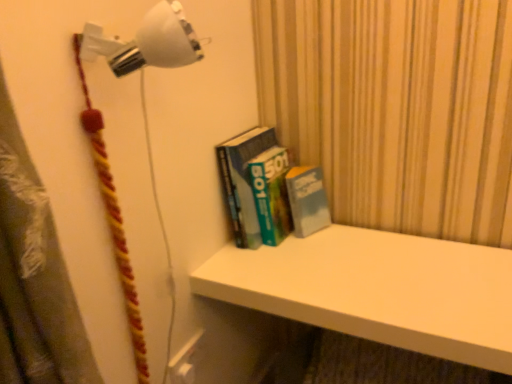
Where is `white plastic lamp at upper left, which is counted as the first lamp, starting from the bottom`? The height and width of the screenshot is (384, 512). white plastic lamp at upper left, which is counted as the first lamp, starting from the bottom is located at coordinates (103, 125).

Which is further, [88,94] or [323,187]?

The point [323,187] is farther from the camera.

From a real-world perspective, relative to hardcover books at center, is white plastic lamp at upper left, which ranks as the 2th lamp in top-to-bottom order, vertically above or below?

In terms of real-world spatial position, white plastic lamp at upper left, which ranks as the 2th lamp in top-to-bottom order, is above hardcover books at center.

From the image's perspective, relative to hardcover books at center, is white plastic lamp at upper left, which is counted as the first lamp, starting from the bottom, above or below?

white plastic lamp at upper left, which is counted as the first lamp, starting from the bottom, is below hardcover books at center.

Is white plastic lamp at upper left, which ranks as the 2th lamp in top-to-bottom order, wider than hardcover books at center?

No.

Is white plastic lamp at upper left, which is counted as the first lamp, starting from the bottom, to the left or to the right of white plastic wall lamp at upper left, the 2th lamp in the bottom-to-top sequence, in the image?

Based on their positions, white plastic lamp at upper left, which is counted as the first lamp, starting from the bottom, is located to the left of white plastic wall lamp at upper left, the 2th lamp in the bottom-to-top sequence.

Is point (106, 61) more distant than point (131, 66)?

That is True.

How many degrees apart are the facing directions of white plastic lamp at upper left, which ranks as the 2th lamp in top-to-bottom order, and white plastic wall lamp at upper left, which is counted as the first lamp, starting from the top?

There is a 0.00514-degree angle between the facing directions of white plastic lamp at upper left, which ranks as the 2th lamp in top-to-bottom order, and white plastic wall lamp at upper left, which is counted as the first lamp, starting from the top.

Which object is closer to the camera taking this photo, white plastic lamp at upper left, which ranks as the 2th lamp in top-to-bottom order, or white plastic wall lamp at upper left, the 2th lamp in the bottom-to-top sequence?

white plastic wall lamp at upper left, the 2th lamp in the bottom-to-top sequence, is in front.

How many degrees apart are the facing directions of white plastic wall lamp at upper left, which is counted as the first lamp, starting from the top, and white matte shelf at upper center?

They differ by 90 degrees in their facing directions.

From the image's perspective, is white plastic wall lamp at upper left, which is counted as the first lamp, starting from the top, located beneath white matte shelf at upper center?

Actually, white plastic wall lamp at upper left, which is counted as the first lamp, starting from the top, appears above white matte shelf at upper center in the image.

Is white plastic wall lamp at upper left, the 2th lamp in the bottom-to-top sequence, shorter than white matte shelf at upper center?

Correct, white plastic wall lamp at upper left, the 2th lamp in the bottom-to-top sequence, is not as tall as white matte shelf at upper center.

Is white matte shelf at upper center positioned before white plastic wall lamp at upper left, which is counted as the first lamp, starting from the top?

No, white matte shelf at upper center is behind white plastic wall lamp at upper left, which is counted as the first lamp, starting from the top.

Looking at this image, from a real-world perspective, is white matte shelf at upper center positioned above or below white plastic wall lamp at upper left, which is counted as the first lamp, starting from the top?

white matte shelf at upper center is below white plastic wall lamp at upper left, which is counted as the first lamp, starting from the top.

Who is taller, white matte shelf at upper center or white plastic wall lamp at upper left, the 2th lamp in the bottom-to-top sequence?

white matte shelf at upper center.

Is point (179, 5) positioned behind point (123, 247)?

Yes, it is.

Based on the photo, from a real-world perspective, is white plastic wall lamp at upper left, the 2th lamp in the bottom-to-top sequence, positioned over white plastic lamp at upper left, which ranks as the 2th lamp in top-to-bottom order, based on gravity?

Correct, in the physical world, white plastic wall lamp at upper left, the 2th lamp in the bottom-to-top sequence, is higher than white plastic lamp at upper left, which ranks as the 2th lamp in top-to-bottom order.

Is white plastic wall lamp at upper left, which is counted as the first lamp, starting from the top, smaller than white plastic lamp at upper left, which ranks as the 2th lamp in top-to-bottom order?

Incorrect, white plastic wall lamp at upper left, which is counted as the first lamp, starting from the top, is not smaller in size than white plastic lamp at upper left, which ranks as the 2th lamp in top-to-bottom order.

Which of these two, white plastic wall lamp at upper left, the 2th lamp in the bottom-to-top sequence, or white plastic lamp at upper left, which is counted as the first lamp, starting from the bottom, stands taller?

Standing taller between the two is white plastic lamp at upper left, which is counted as the first lamp, starting from the bottom.

Which of these two, white matte shelf at upper center or hardcover books at center, is thinner?

With smaller width is hardcover books at center.

Between white matte shelf at upper center and hardcover books at center, which one appears on the left side from the viewer's perspective?

From the viewer's perspective, hardcover books at center appears more on the left side.

Is point (460, 325) positioned behind point (253, 166)?

No, (460, 325) is closer to viewer.

This screenshot has height=384, width=512. What are the coordinates of `shelf lying on the right of hardcover books at center` in the screenshot? It's located at [x=378, y=290].

Is white plastic lamp at upper left, which ranks as the 2th lamp in top-to-bottom order, inside white matte shelf at upper center?

No.

Does point (422, 301) appear closer or farther from the camera than point (177, 29)?

Point (422, 301) is farther from the camera than point (177, 29).

From a real-world perspective, is white matte shelf at upper center positioned under white plastic lamp at upper left, which ranks as the 2th lamp in top-to-bottom order, based on gravity?

Yes, from a real-world perspective, white matte shelf at upper center is below white plastic lamp at upper left, which ranks as the 2th lamp in top-to-bottom order.

Which of these two, white matte shelf at upper center or white plastic lamp at upper left, which ranks as the 2th lamp in top-to-bottom order, is smaller?

white plastic lamp at upper left, which ranks as the 2th lamp in top-to-bottom order.

What are the coordinates of `book on the right of white plastic lamp at upper left, which ranks as the 2th lamp in top-to-bottom order` in the screenshot? It's located at (270, 190).

You are a GUI agent. You are given a task and a screenshot of the screen. Output one action in this format:
    pyautogui.click(x=<x>, y=<y>)
    Task: Click on the lamp to the left of white plastic wall lamp at upper left, which is counted as the first lamp, starting from the top
    This screenshot has width=512, height=384.
    Given the screenshot: What is the action you would take?
    pyautogui.click(x=103, y=125)

From the image, which object appears to be farther from white matte shelf at upper center, white plastic wall lamp at upper left, which is counted as the first lamp, starting from the top, or white plastic lamp at upper left, which ranks as the 2th lamp in top-to-bottom order?

white plastic wall lamp at upper left, which is counted as the first lamp, starting from the top, lies further to white matte shelf at upper center than the other object.

Considering their positions, is white matte shelf at upper center positioned closer to white plastic wall lamp at upper left, which is counted as the first lamp, starting from the top, than hardcover books at center?

hardcover books at center is positioned closer to the anchor white plastic wall lamp at upper left, which is counted as the first lamp, starting from the top.

Based on their spatial positions, is white plastic wall lamp at upper left, which is counted as the first lamp, starting from the top, or white matte shelf at upper center closer to white plastic lamp at upper left, which is counted as the first lamp, starting from the bottom?

white plastic wall lamp at upper left, which is counted as the first lamp, starting from the top, is positioned closer to the anchor white plastic lamp at upper left, which is counted as the first lamp, starting from the bottom.

From the image, which object appears to be nearer to white plastic wall lamp at upper left, the 2th lamp in the bottom-to-top sequence, white matte shelf at upper center or white plastic lamp at upper left, which is counted as the first lamp, starting from the bottom?

white plastic lamp at upper left, which is counted as the first lamp, starting from the bottom.

Based on their spatial positions, is white plastic lamp at upper left, which is counted as the first lamp, starting from the bottom, or white matte shelf at upper center further from white plastic wall lamp at upper left, the 2th lamp in the bottom-to-top sequence?

Based on the image, white matte shelf at upper center appears to be further to white plastic wall lamp at upper left, the 2th lamp in the bottom-to-top sequence.

From the image, which object appears to be farther from white matte shelf at upper center, white plastic lamp at upper left, which ranks as the 2th lamp in top-to-bottom order, or hardcover books at center?

white plastic lamp at upper left, which ranks as the 2th lamp in top-to-bottom order, is positioned further to the anchor white matte shelf at upper center.

From the image, which object appears to be farther from white plastic wall lamp at upper left, which is counted as the first lamp, starting from the top, hardcover books at center or white matte shelf at upper center?

white matte shelf at upper center.

When comparing their distances from hardcover books at center, does white plastic wall lamp at upper left, which is counted as the first lamp, starting from the top, or white plastic lamp at upper left, which is counted as the first lamp, starting from the bottom, seem closer?

The object closer to hardcover books at center is white plastic lamp at upper left, which is counted as the first lamp, starting from the bottom.

Where is `book between white plastic lamp at upper left, which ranks as the 2th lamp in top-to-bottom order, and white matte shelf at upper center, in the horizontal direction`? Image resolution: width=512 pixels, height=384 pixels. book between white plastic lamp at upper left, which ranks as the 2th lamp in top-to-bottom order, and white matte shelf at upper center, in the horizontal direction is located at coordinates (270, 190).

Find the location of a particular element. book between white plastic wall lamp at upper left, the 2th lamp in the bottom-to-top sequence, and white matte shelf at upper center, in the vertical direction is located at coordinates (270, 190).

The height and width of the screenshot is (384, 512). Identify the location of lamp between white plastic wall lamp at upper left, which is counted as the first lamp, starting from the top, and white matte shelf at upper center from top to bottom. (103, 125).

Where is `lamp between white plastic wall lamp at upper left, the 2th lamp in the bottom-to-top sequence, and hardcover books at center in the front-back direction`? lamp between white plastic wall lamp at upper left, the 2th lamp in the bottom-to-top sequence, and hardcover books at center in the front-back direction is located at coordinates (103, 125).